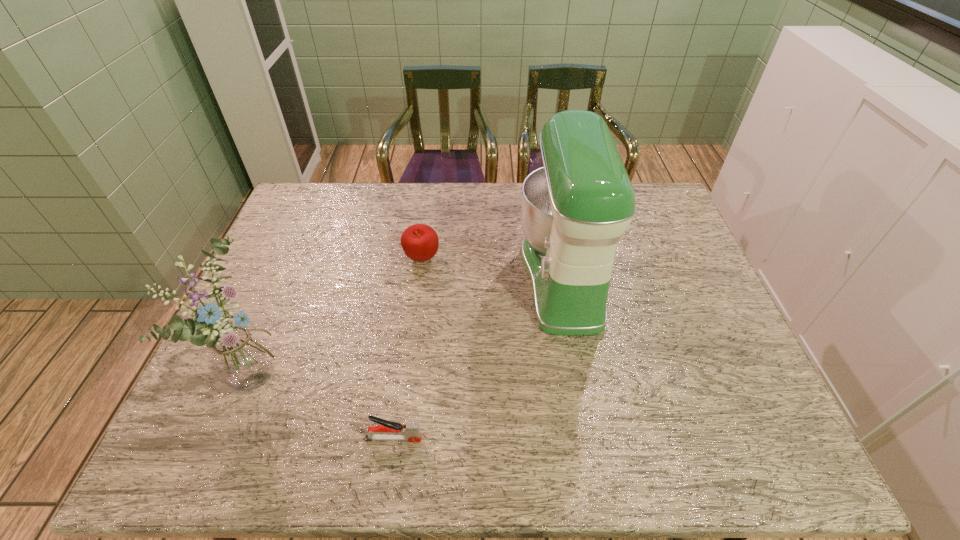
Locate an element on the screen. The width and height of the screenshot is (960, 540). the rightmost object is located at coordinates (574, 209).

Where is `bouquet`? Image resolution: width=960 pixels, height=540 pixels. bouquet is located at coordinates (242, 359).

The width and height of the screenshot is (960, 540). I want to click on apple, so click(x=420, y=242).

Identify the location of stapler. (387, 430).

Locate an element on the screen. This screenshot has height=540, width=960. the shortest object is located at coordinates (387, 430).

Locate an element on the screen. The height and width of the screenshot is (540, 960). vacant space located on the controls of the rightmost object is located at coordinates (389, 276).

You are a GUI agent. You are given a task and a screenshot of the screen. Output one action in this format:
    pyautogui.click(x=<x>, y=<y>)
    Task: Click on the vacant space located on the controls of the rightmost object
    This screenshot has width=960, height=540.
    Given the screenshot: What is the action you would take?
    pyautogui.click(x=429, y=276)

Locate an element on the screen. The image size is (960, 540). vacant area situated 0.100m on the controls of the rightmost object is located at coordinates (484, 276).

Locate an element on the screen. free location located on the front-facing side of the leftmost object is located at coordinates (412, 371).

The image size is (960, 540). Identify the location of free region located on the right of the apple. (572, 259).